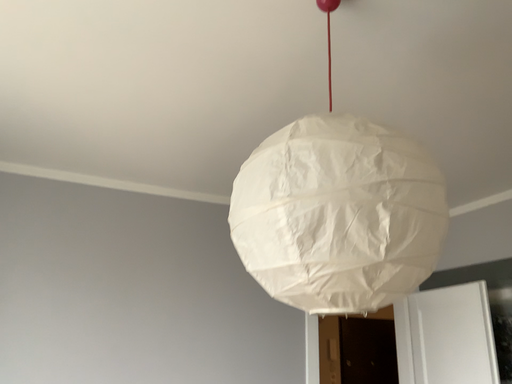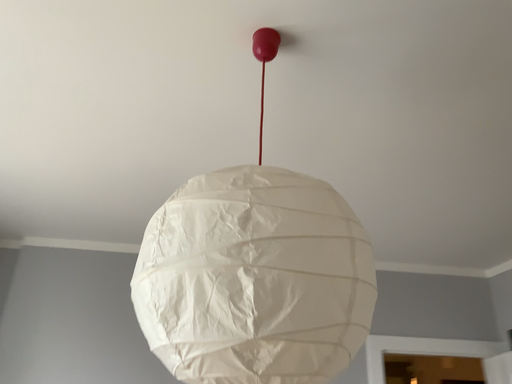
Question: Which way did the camera rotate in the video?

Choices:
 (A) rotated upward
 (B) rotated downward

Answer: (A)